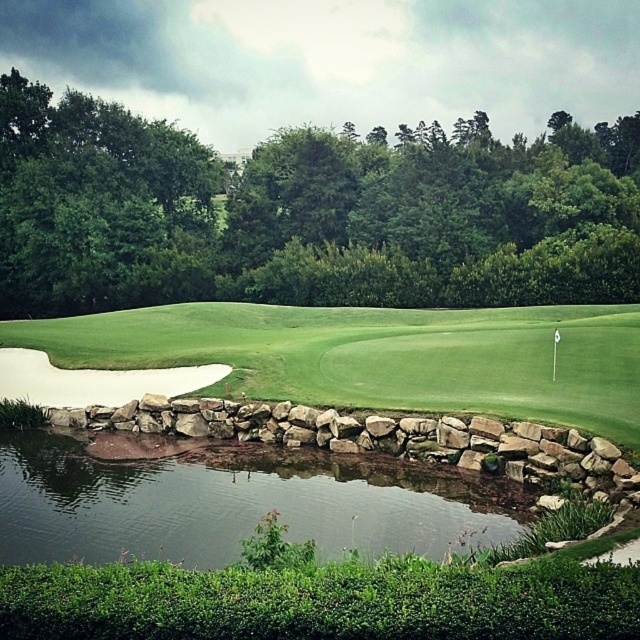
Question: Is green leafy tree at upper center to the right of green grassy golf course at center from the viewer's perspective?

Choices:
 (A) yes
 (B) no

Answer: (A)

Question: Estimate the real-world distances between objects in this image. Which object is farther from the green leafy tree at upper center?

Choices:
 (A) green grassy golf course at center
 (B) clear water at pond center

Answer: (B)

Question: Does green leafy tree at upper center have a smaller size compared to green grassy golf course at center?

Choices:
 (A) yes
 (B) no

Answer: (B)

Question: Which object appears closest to the camera in this image?

Choices:
 (A) green leafy tree at upper center
 (B) clear water at pond center

Answer: (B)

Question: Where is green leafy tree at upper center located in relation to green grassy golf course at center in the image?

Choices:
 (A) left
 (B) right

Answer: (B)

Question: Which object is the farthest from the clear water at pond center?

Choices:
 (A) green grassy golf course at center
 (B) green leafy tree at upper center

Answer: (B)